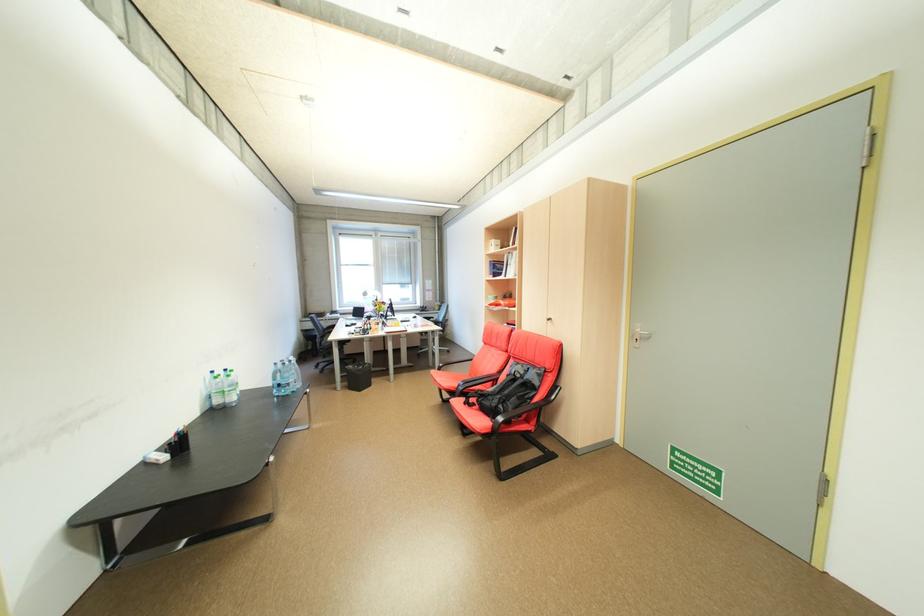
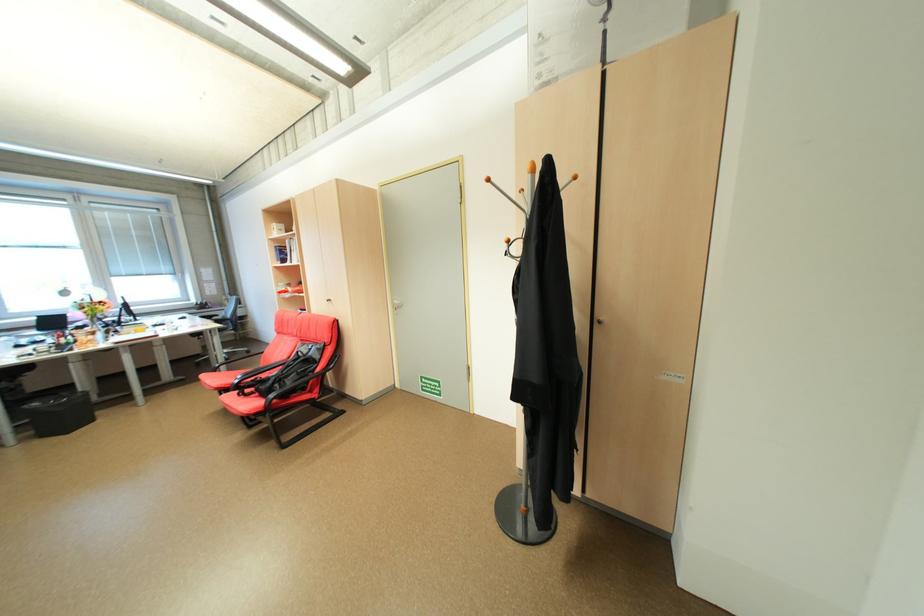
Locate, in the second image, the point that corresponds to pixel 509 407 in the first image.

(286, 386)